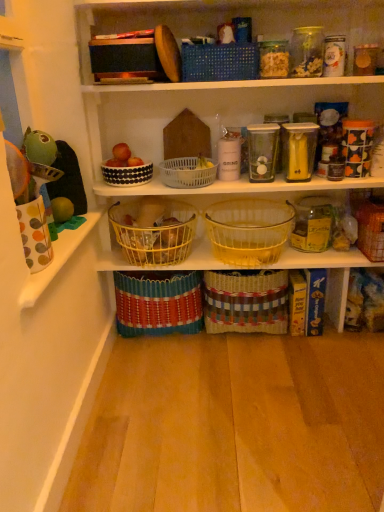
Question: In which direction should I rotate to look at translucent glass basket at center, which is counted as the fifth basket, starting from the bottom?

Choices:
 (A) right
 (B) left

Answer: (A)

Question: Which direction should I rotate to face black dotted bowl at upper center, which is counted as the second basket, starting from the top, — up or down?

Choices:
 (A) up
 (B) down

Answer: (A)

Question: Is woven brown basket at center, acting as the seventh basket starting from the top, not close to white plastic basket at center, the third basket from the top?

Choices:
 (A) no
 (B) yes

Answer: (A)

Question: Considering the relative sizes of woven brown basket at center, the 2th basket from the bottom, and white plastic basket at center, the 6th basket positioned from the bottom, in the image provided, is woven brown basket at center, the 2th basket from the bottom, shorter than white plastic basket at center, the 6th basket positioned from the bottom,?

Choices:
 (A) no
 (B) yes

Answer: (A)

Question: Is woven brown basket at center, the 2th basket from the bottom, closer to camera compared to white plastic basket at center, the third basket from the top?

Choices:
 (A) no
 (B) yes

Answer: (A)

Question: Is white plastic basket at center, the 6th basket positioned from the bottom, a part of woven brown basket at center, the 2th basket from the bottom?

Choices:
 (A) no
 (B) yes

Answer: (A)

Question: Is woven brown basket at center, the 2th basket from the bottom, aimed at white plastic basket at center, the 6th basket positioned from the bottom?

Choices:
 (A) no
 (B) yes

Answer: (A)

Question: From the image's perspective, is woven brown basket at center, the 2th basket from the bottom, below white plastic basket at center, the third basket from the top?

Choices:
 (A) no
 (B) yes

Answer: (B)

Question: Is yellow wire basket at center, the 6th basket when ordered from top to bottom, in front of woven brown basket at lower right, marked as the fifth basket in a top-to-bottom arrangement?

Choices:
 (A) yes
 (B) no

Answer: (A)

Question: Considering the relative sizes of yellow wire basket at center, which is the 3th basket in bottom-to-top order, and woven brown basket at lower right, placed as the 4th basket when sorted from bottom to top, in the image provided, is yellow wire basket at center, which is the 3th basket in bottom-to-top order, smaller than woven brown basket at lower right, placed as the 4th basket when sorted from bottom to top,?

Choices:
 (A) yes
 (B) no

Answer: (B)

Question: Could you tell me if yellow wire basket at center, which is the 3th basket in bottom-to-top order, is turned towards woven brown basket at lower right, marked as the fifth basket in a top-to-bottom arrangement?

Choices:
 (A) yes
 (B) no

Answer: (B)

Question: From a real-world perspective, is yellow wire basket at center, which is the 3th basket in bottom-to-top order, on top of woven brown basket at lower right, placed as the 4th basket when sorted from bottom to top?

Choices:
 (A) yes
 (B) no

Answer: (A)

Question: From the image's perspective, is yellow wire basket at center, which is the 3th basket in bottom-to-top order, on top of woven brown basket at lower right, marked as the fifth basket in a top-to-bottom arrangement?

Choices:
 (A) yes
 (B) no

Answer: (B)

Question: Considering the relative sizes of yellow wire basket at center, which is the 3th basket in bottom-to-top order, and woven brown basket at lower right, placed as the 4th basket when sorted from bottom to top, in the image provided, is yellow wire basket at center, which is the 3th basket in bottom-to-top order, thinner than woven brown basket at lower right, placed as the 4th basket when sorted from bottom to top,?

Choices:
 (A) yes
 (B) no

Answer: (B)

Question: Considering the relative sizes of white plastic basket at center, the 6th basket positioned from the bottom, and translucent glass basket at center, marked as the fourth basket in a top-to-bottom arrangement, in the image provided, is white plastic basket at center, the 6th basket positioned from the bottom, taller than translucent glass basket at center, marked as the fourth basket in a top-to-bottom arrangement,?

Choices:
 (A) no
 (B) yes

Answer: (A)